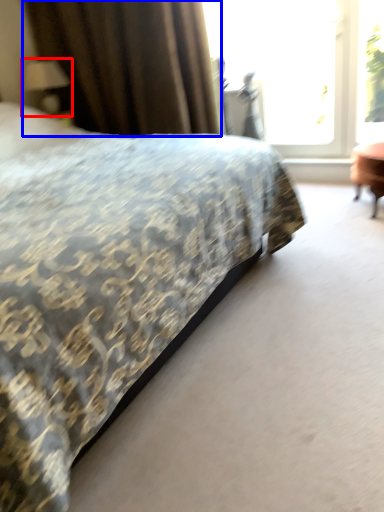
Question: Which point is closer to the camera, table lamp (highlighted by a red box) or curtain (highlighted by a blue box)?

Choices:
 (A) table lamp
 (B) curtain

Answer: (B)